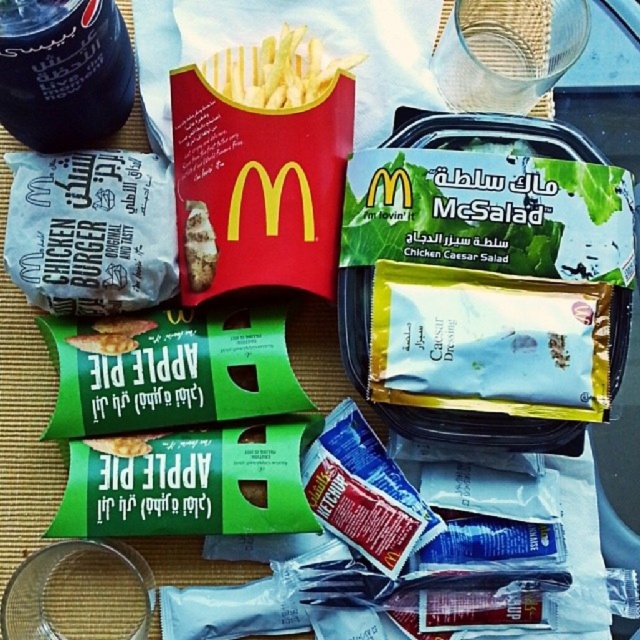
Which is below, dark matte soda can at upper left or golden crispy fries at center?

Positioned lower is dark matte soda can at upper left.

Does point (26, 88) lie behind point (209, 74)?

No, (26, 88) is in front of (209, 74).

I want to click on dark matte soda can at upper left, so click(64, 72).

Find the location of a particular element. The height and width of the screenshot is (640, 640). dark matte soda can at upper left is located at coordinates (64, 72).

Which is behind, point (156, 268) or point (289, 52)?

Positioned behind is point (289, 52).

Which is behind, point (108, 296) or point (346, 60)?

Positioned behind is point (346, 60).

Locate an element on the screen. Image resolution: width=640 pixels, height=640 pixels. white paper chicken burger at left is located at coordinates (92, 230).

From the picture: Does white paper chicken burger at left appear under dark matte soda can at upper left?

Yes, white paper chicken burger at left is below dark matte soda can at upper left.

Looking at this image, is white paper chicken burger at left smaller than dark matte soda can at upper left?

Indeed, white paper chicken burger at left has a smaller size compared to dark matte soda can at upper left.

I want to click on white paper chicken burger at left, so click(x=92, y=230).

You are a GUI agent. You are given a task and a screenshot of the screen. Output one action in this format:
    pyautogui.click(x=<x>, y=<y>)
    Task: Click on the white paper chicken burger at left
    
    Given the screenshot: What is the action you would take?
    pyautogui.click(x=92, y=230)